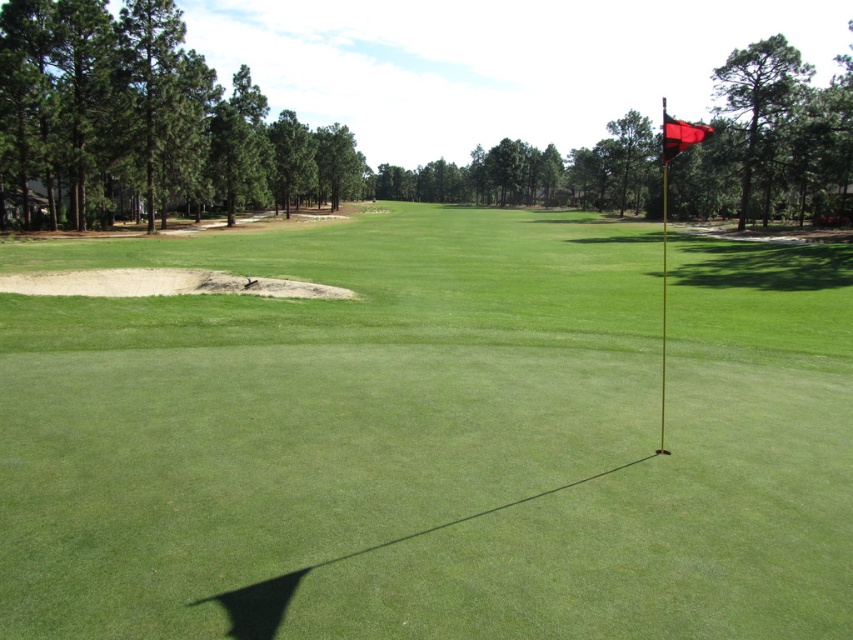
Question: Is green turf flag at right positioned behind red fabric flag at upper right?

Choices:
 (A) yes
 (B) no

Answer: (B)

Question: Can you confirm if green turf flag at right is positioned to the right of red fabric flag at upper right?

Choices:
 (A) no
 (B) yes

Answer: (A)

Question: Where is green turf flag at right located in relation to red fabric flag at upper right in the image?

Choices:
 (A) right
 (B) left

Answer: (B)

Question: Which point is closer to the camera taking this photo?

Choices:
 (A) (196, 410)
 (B) (676, 140)

Answer: (B)